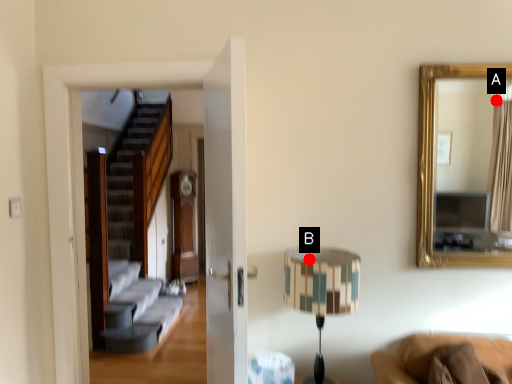
Question: Two points are circled on the image, labeled by A and B beside each circle. Which point appears farthest from the camera in this image?

Choices:
 (A) A is further
 (B) B is further

Answer: (A)